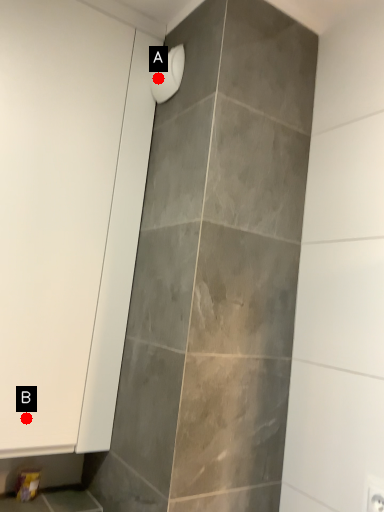
Question: Two points are circled on the image, labeled by A and B beside each circle. Which of the following is the farthest from the observer?

Choices:
 (A) A is further
 (B) B is further

Answer: (A)